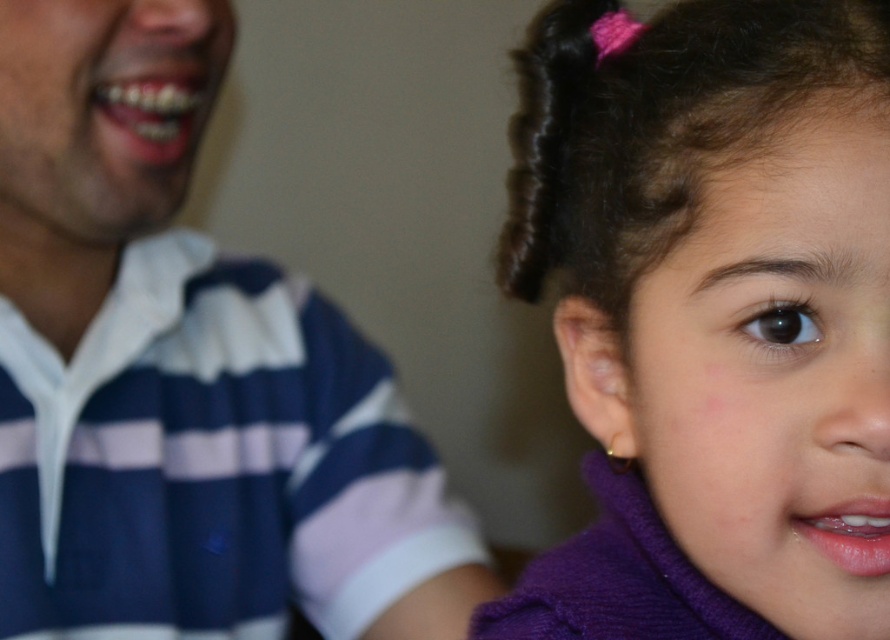
Question: Is purple fuzzy sweater at right positioned at the back of dark brown curly hair at upper right?

Choices:
 (A) yes
 (B) no

Answer: (B)

Question: Which object appears farthest from the camera in this image?

Choices:
 (A) striped cotton shirt at left
 (B) dark brown curly hair at upper right

Answer: (A)

Question: Is purple fuzzy sweater at right smaller than dark brown curly hair at upper right?

Choices:
 (A) yes
 (B) no

Answer: (B)

Question: Is purple fuzzy sweater at right positioned at the back of striped cotton shirt at left?

Choices:
 (A) no
 (B) yes

Answer: (A)

Question: Which point appears closest to the camera in this image?

Choices:
 (A) (617, 170)
 (B) (783, 372)
 (C) (320, 307)

Answer: (B)

Question: Which of the following is the farthest from the observer?

Choices:
 (A) (549, 106)
 (B) (184, 579)

Answer: (B)